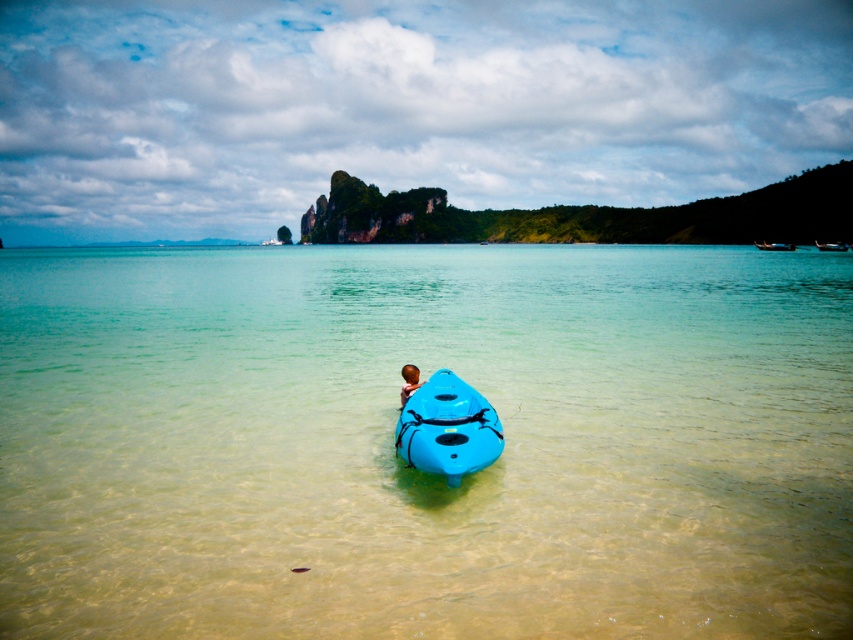
Question: Does clear plastic water at center come behind brown hair at center?

Choices:
 (A) no
 (B) yes

Answer: (A)

Question: Which object is the farthest from the blue plastic kayak at center?

Choices:
 (A) blue plastic canoe at center
 (B) wooden canoe at upper right
 (C) brown hair at center
 (D) clear plastic water at center

Answer: (C)

Question: Among these objects, which one is nearest to the camera?

Choices:
 (A) blue plastic canoe at center
 (B) clear plastic water at center

Answer: (B)

Question: Which object is farther from the camera taking this photo?

Choices:
 (A) blue plastic kayak at center
 (B) wooden canoe at upper right
 (C) blue plastic canoe at center

Answer: (A)

Question: Does blue plastic canoe at center appear under brown hair at center?

Choices:
 (A) yes
 (B) no

Answer: (A)

Question: Is blue plastic kayak at center positioned at the back of wooden canoe at upper right?

Choices:
 (A) yes
 (B) no

Answer: (A)